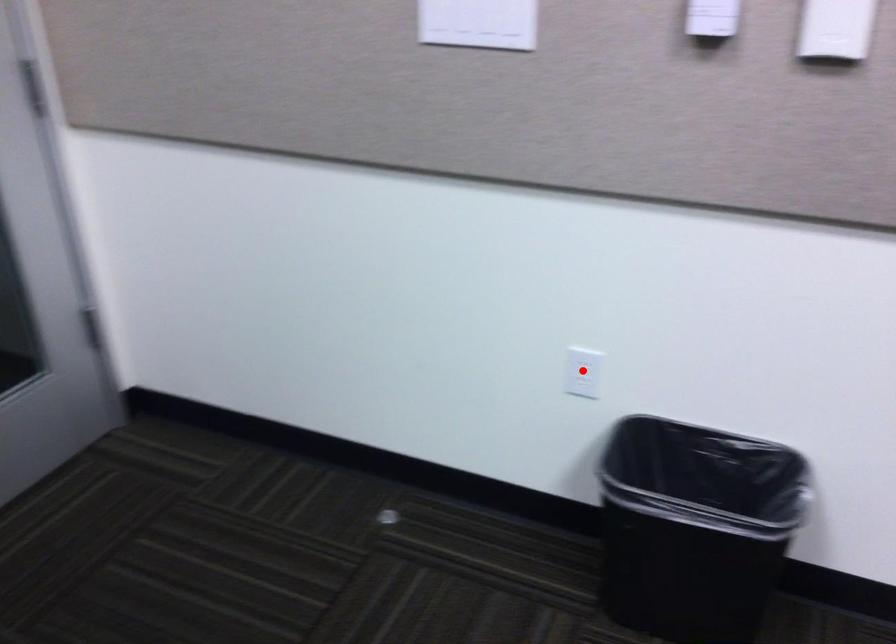
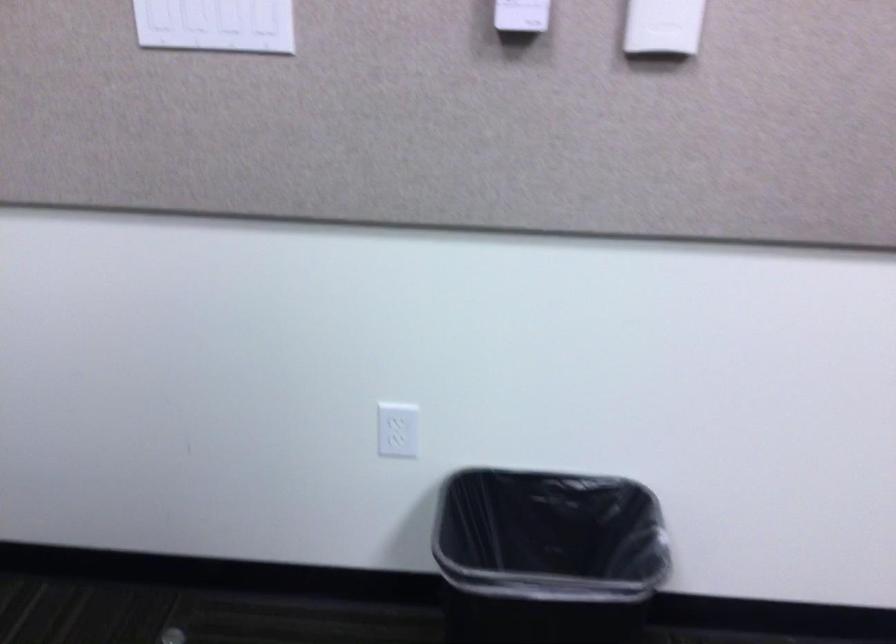
Where in the second image is the point corresponding to the highlighted location from the first image?

(398, 430)